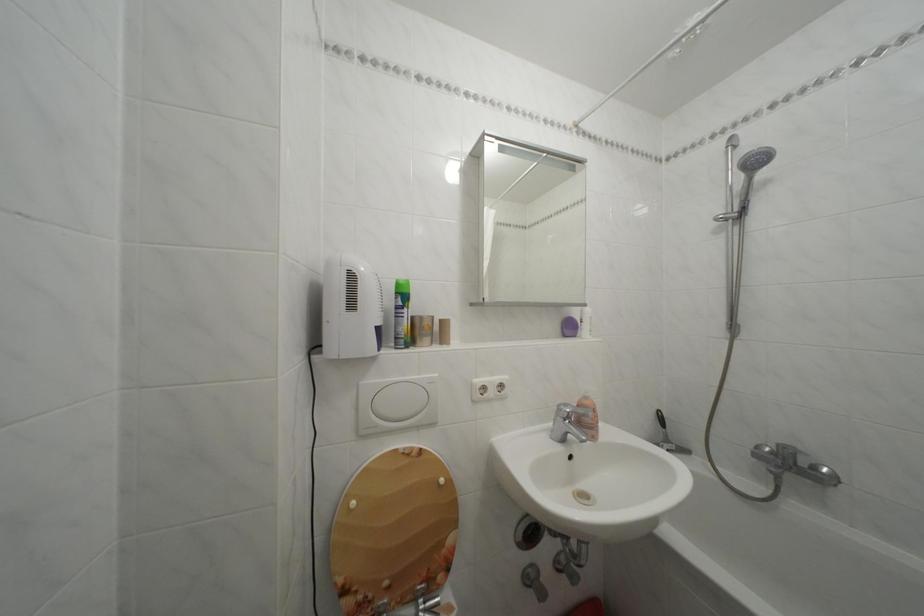
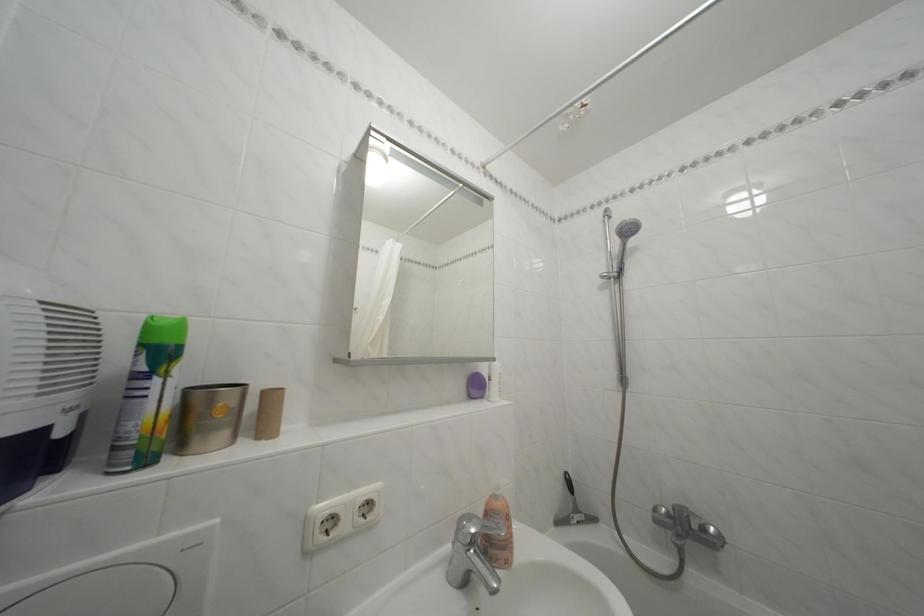
Question: The camera is either moving clockwise (left) or counter-clockwise (right) around the object. The first image is from the beginning of the video and the second image is from the end. Is the camera moving left or right when shooting the video?

Choices:
 (A) Left
 (B) Right

Answer: (A)